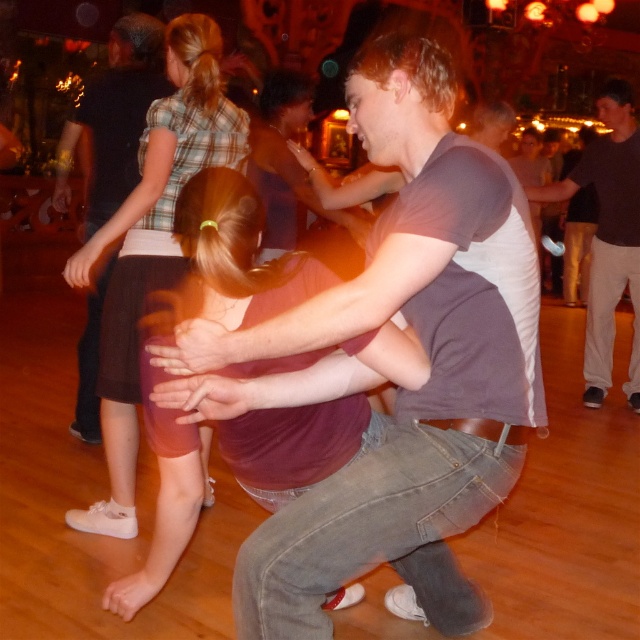
In the dance scene, there are a brown skirt at lower left and a matte brown shirt at center. Which object is positioned more to the right side of the image?

The brown skirt at lower left is positioned to the right of the matte brown shirt at center, so the brown skirt at lower left is more to the right side of the image.

In the dance scene, there is a point marked at coordinates (152, 243). What object is located at this point?

The point at coordinates (152, 243) indicates a brown skirt at lower left.